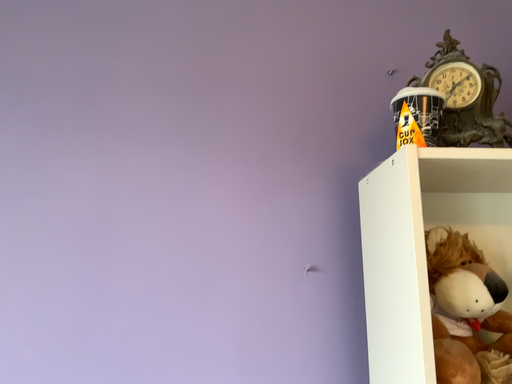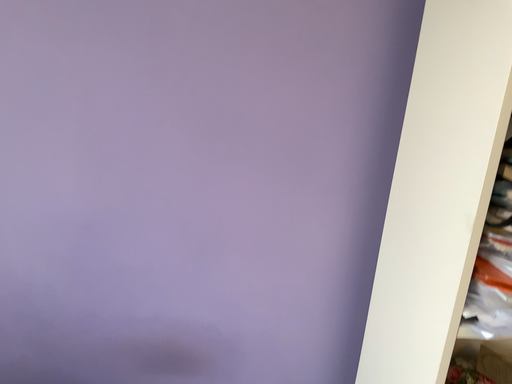
Question: How did the camera likely rotate when shooting the video?

Choices:
 (A) rotated upward
 (B) rotated downward

Answer: (B)